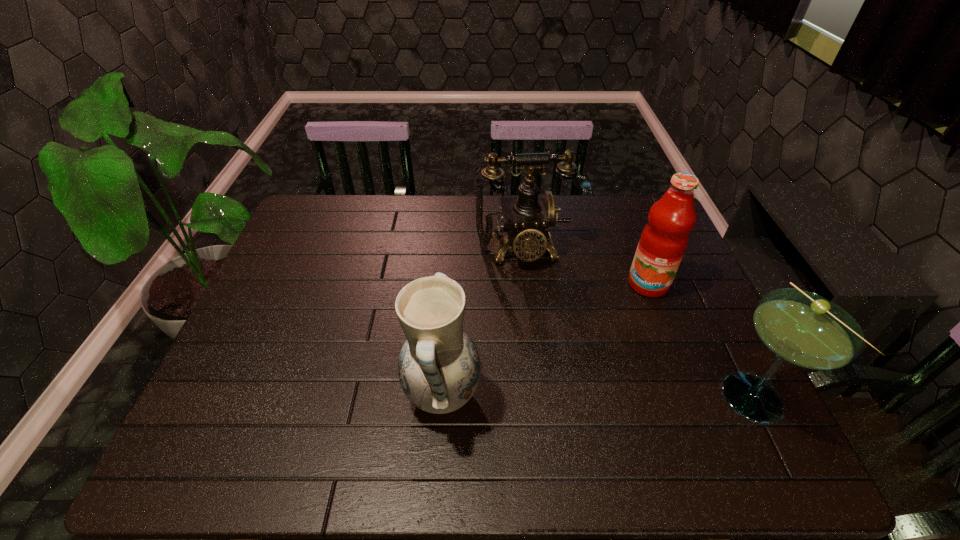
The height and width of the screenshot is (540, 960). In order to click on vacant spot on the desktop that is between the pottery and the martini and is positioned on the front label of the fruit juice in this screenshot , I will do `click(625, 395)`.

Where is `vacant spot on the desktop that is between the pottery and the shortest object and is positioned on the rotary dial of the telephone`? The height and width of the screenshot is (540, 960). vacant spot on the desktop that is between the pottery and the shortest object and is positioned on the rotary dial of the telephone is located at coordinates (552, 395).